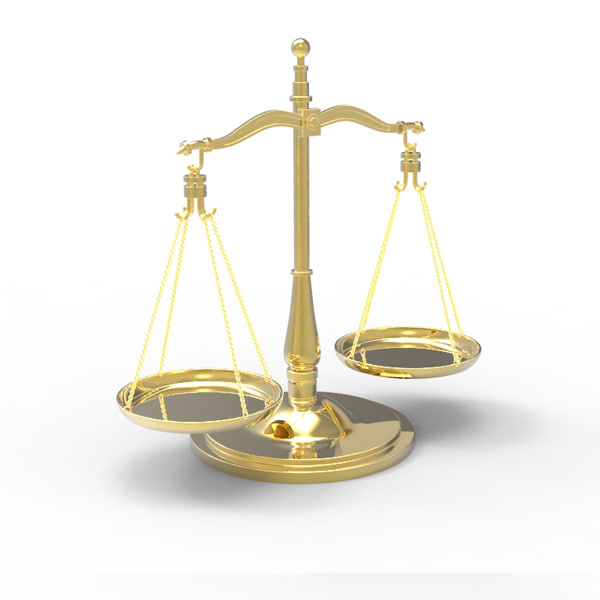
Identify the location of plate. (195, 400).